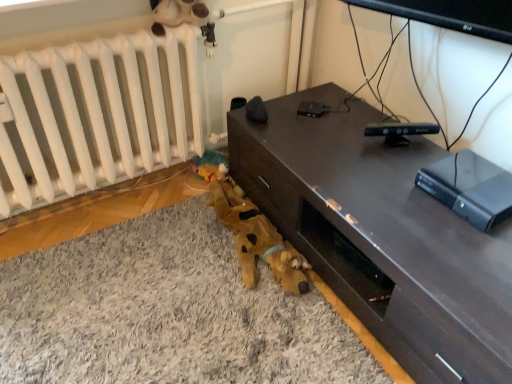
At what (x,y) coordinates should I click in order to perform the action: click on vacant area located to the right-hand side of black plastic remote control at center, the second gadget positioned from the front. Please return your answer as a coordinate pair (x, y). Looking at the image, I should click on (352, 112).